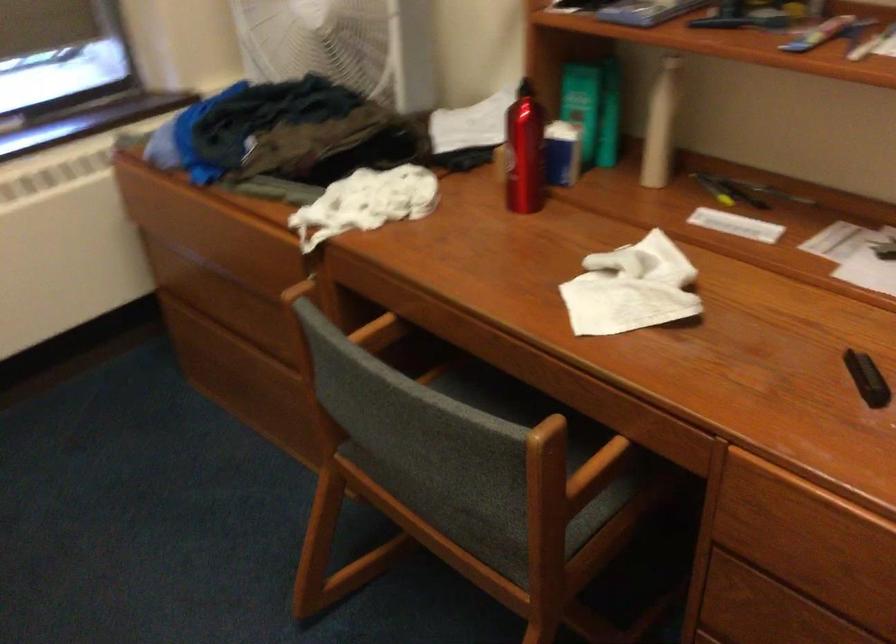
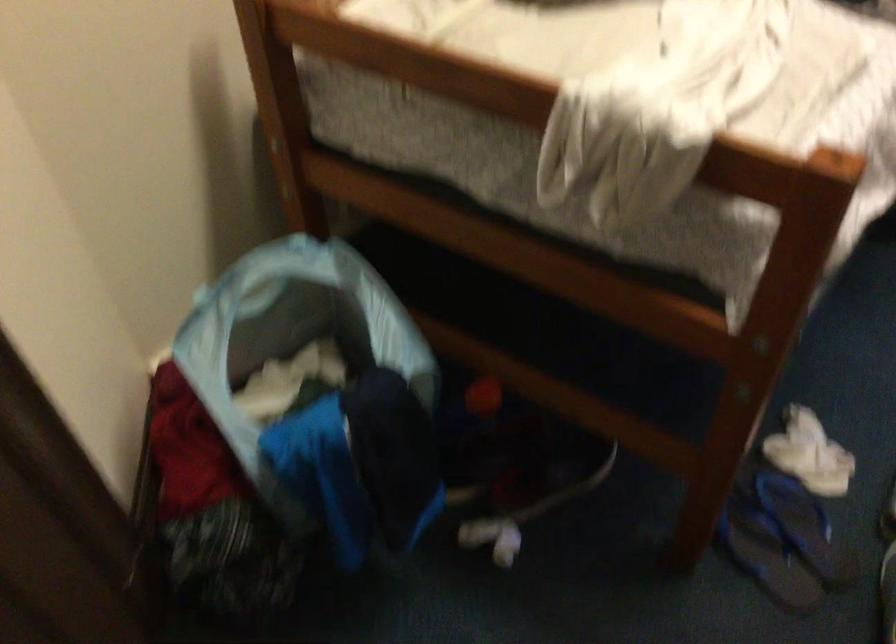
The images are taken continuously from a first-person perspective. In which direction is your viewpoint rotating?

The camera rotated toward left-down.